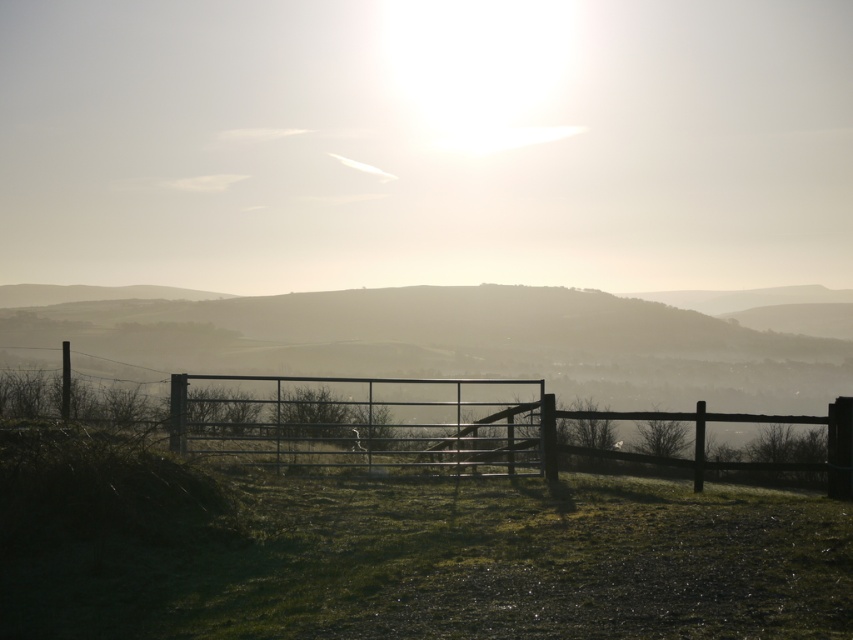
Question: Does green grassy at center appear on the left side of metallic gate at center?

Choices:
 (A) yes
 (B) no

Answer: (B)

Question: In this image, where is green grassy at center located relative to metallic gate at center?

Choices:
 (A) left
 (B) right

Answer: (B)

Question: Which of the following is the farthest from the observer?

Choices:
 (A) (202, 397)
 (B) (726, 605)

Answer: (A)

Question: Is green grassy at center below metallic gate at center?

Choices:
 (A) no
 (B) yes

Answer: (B)